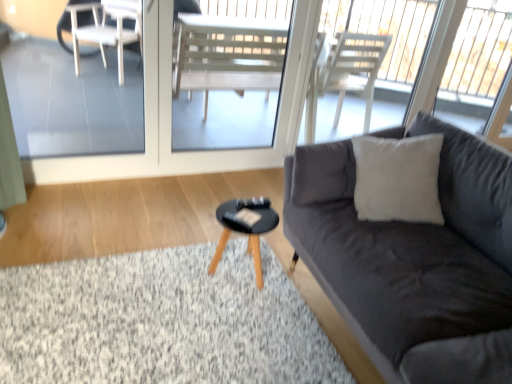
Question: From the image's perspective, is black wooden coffee table at center located above or below transparent glass screen door at upper center?

Choices:
 (A) below
 (B) above

Answer: (A)

Question: In terms of size, does black wooden coffee table at center appear bigger or smaller than transparent glass screen door at upper center?

Choices:
 (A) big
 (B) small

Answer: (B)

Question: Which object is the closest to the transparent glass screen door at upper center?

Choices:
 (A) soft gray carpet at lower left
 (B) black wooden coffee table at center
 (C) dark gray fabric couch at right
 (D) transparent glass window at upper right

Answer: (B)

Question: Which object is the farthest from the black wooden coffee table at center?

Choices:
 (A) transparent glass screen door at upper center
 (B) dark gray fabric couch at right
 (C) soft gray carpet at lower left
 (D) transparent glass window at upper right

Answer: (D)